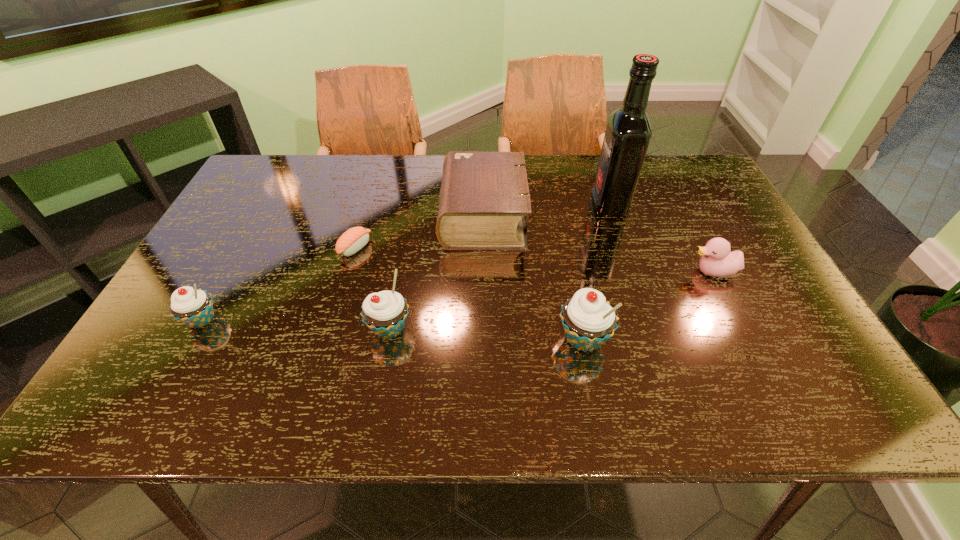
The width and height of the screenshot is (960, 540). Identify the location of free space between the third tallest object and the sushi. (372, 288).

Where is `free space between the second object from left to right and the third object from right to left`? free space between the second object from left to right and the third object from right to left is located at coordinates (469, 293).

This screenshot has height=540, width=960. Identify the location of vacant point located between the fourth farthest object and the shortest object. (534, 260).

This screenshot has width=960, height=540. In order to click on free space between the sixth object from left to right and the fourth object from left to right in this screenshot , I will do pos(546,211).

Where is `the third closest object to the third object from right to left`? the third closest object to the third object from right to left is located at coordinates (385, 312).

Identify which object is the fourth closest to the Bible. Please provide its 2D coordinates. Your answer should be formatted as a tuple, i.e. [(x, y)], where the tuple contains the x and y coordinates of a point satisfying the conditions above.

[(588, 319)]

Where is `cupcake that is the second closest to the fifth object from left to right`? cupcake that is the second closest to the fifth object from left to right is located at coordinates (193, 307).

Find the location of `cupcake that stands as the second closest to the shortest cupcake`. cupcake that stands as the second closest to the shortest cupcake is located at coordinates point(588,319).

At what (x,y) coordinates should I click in order to perform the action: click on free region that satisfies the following two spatial constraints: 1. on the spine side of the third object from right to left; 2. on the left side of the Bible. Please return your answer as a coordinate pair (x, y). The image size is (960, 540). Looking at the image, I should click on point(484,339).

Find the location of a particular element. free space in the image that satisfies the following two spatial constraints: 1. on the front-facing side of the tallest object; 2. on the front side of the shortest cupcake is located at coordinates (648, 320).